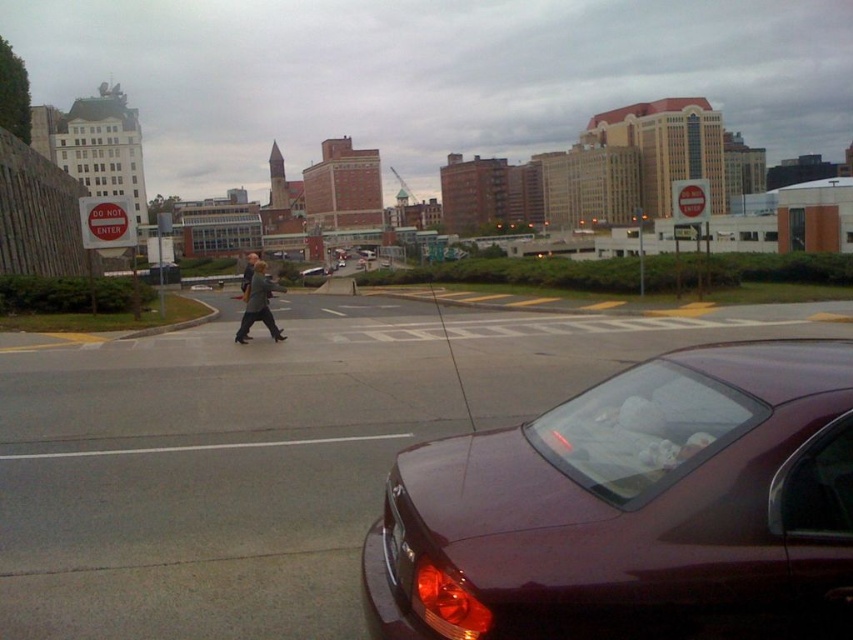
Question: Does glossy maroon car at lower right have a greater width compared to dark gray jacket at center?

Choices:
 (A) yes
 (B) no

Answer: (B)

Question: Among these objects, which one is farthest from the camera?

Choices:
 (A) dark gray jacket at center
 (B) glossy maroon car at lower right

Answer: (A)

Question: Which of the following is the farthest from the observer?

Choices:
 (A) (245, 292)
 (B) (750, 403)

Answer: (A)

Question: Is glossy maroon car at lower right closer to the viewer compared to dark gray jacket at center?

Choices:
 (A) yes
 (B) no

Answer: (A)

Question: Which object appears farthest from the camera in this image?

Choices:
 (A) dark gray jacket at center
 (B) glossy maroon car at lower right

Answer: (A)

Question: Can you confirm if glossy maroon car at lower right is positioned to the left of dark gray jacket at center?

Choices:
 (A) no
 (B) yes

Answer: (A)